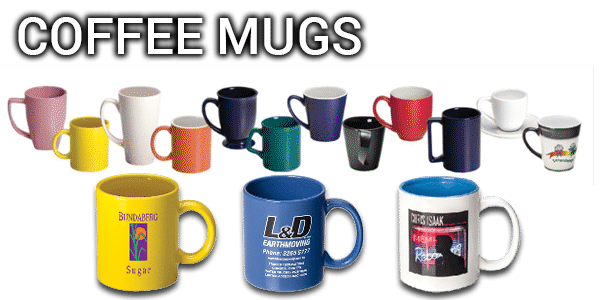
This screenshot has width=600, height=300. I want to click on navy blue mug, so click(x=242, y=116), click(x=460, y=154), click(x=327, y=110).